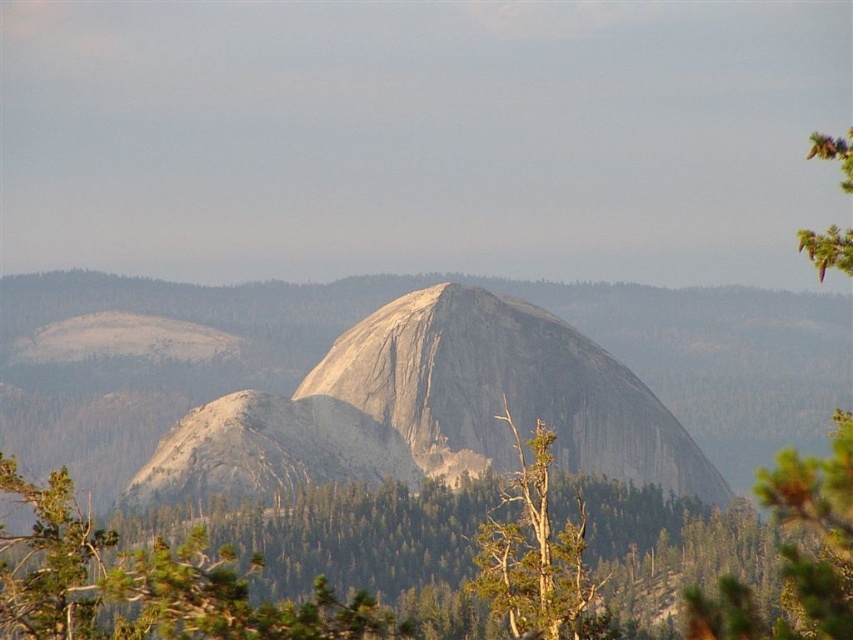
In the scene shown: Which is more to the left, green leafy tree at center or green leafy tree at upper right?

green leafy tree at center is more to the left.

The image size is (853, 640). I want to click on green leafy tree at center, so click(x=149, y=582).

Is gray rock formation at center behind green textured tree at center?

Yes, it is.

Is gray rock formation at center wider than green textured tree at center?

Yes, gray rock formation at center is wider than green textured tree at center.

The image size is (853, 640). What do you see at coordinates (503, 392) in the screenshot?
I see `gray rock formation at center` at bounding box center [503, 392].

You are a GUI agent. You are given a task and a screenshot of the screen. Output one action in this format:
    pyautogui.click(x=<x>, y=<y>)
    Task: Click on the gray rock formation at center
    The image size is (853, 640).
    Given the screenshot: What is the action you would take?
    pyautogui.click(x=503, y=392)

Between green leafy tree at center and green textured tree at center, which one has more height?

Standing taller between the two is green leafy tree at center.

Is point (206, 540) positioned behind point (573, 573)?

That is True.

The width and height of the screenshot is (853, 640). I want to click on green leafy tree at center, so click(149, 582).